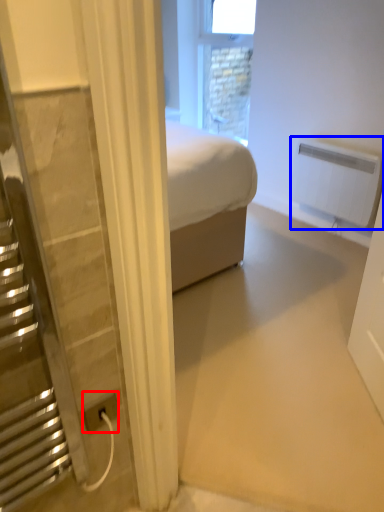
Question: Which of the following is the closest to the observer, power plugs and sockets (highlighted by a red box) or radiator (highlighted by a blue box)?

Choices:
 (A) power plugs and sockets
 (B) radiator

Answer: (A)